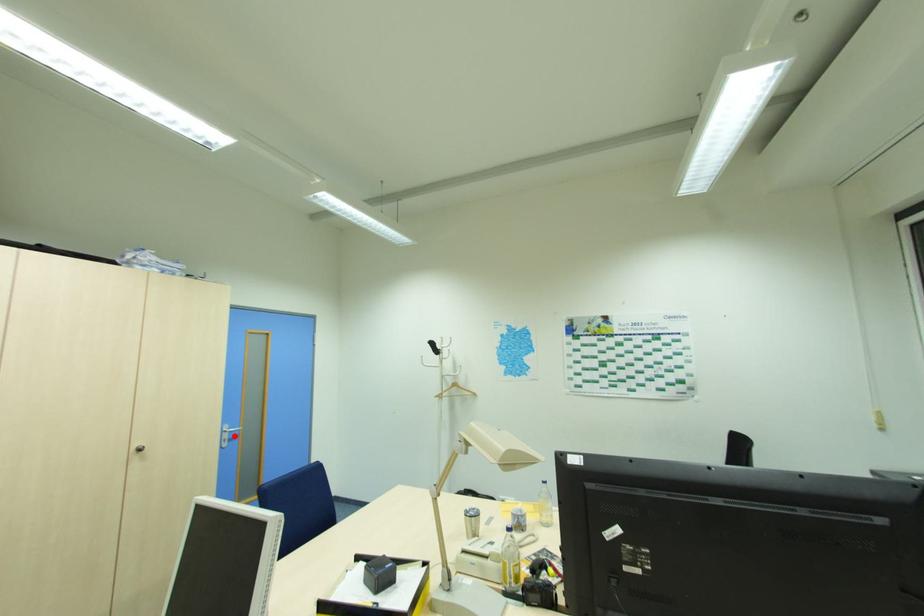
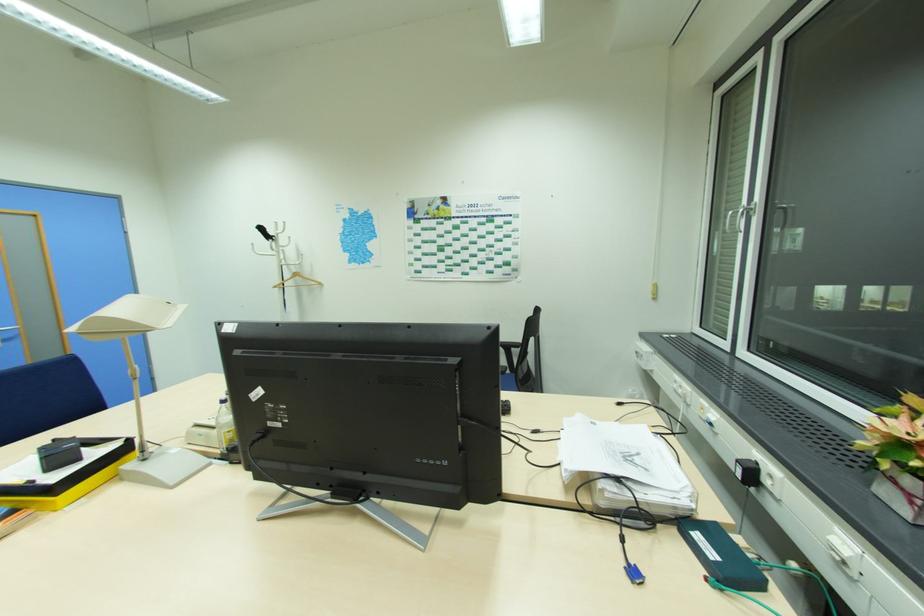
Find the pixel in the second image that matches the highlighted location in the first image.

(11, 337)